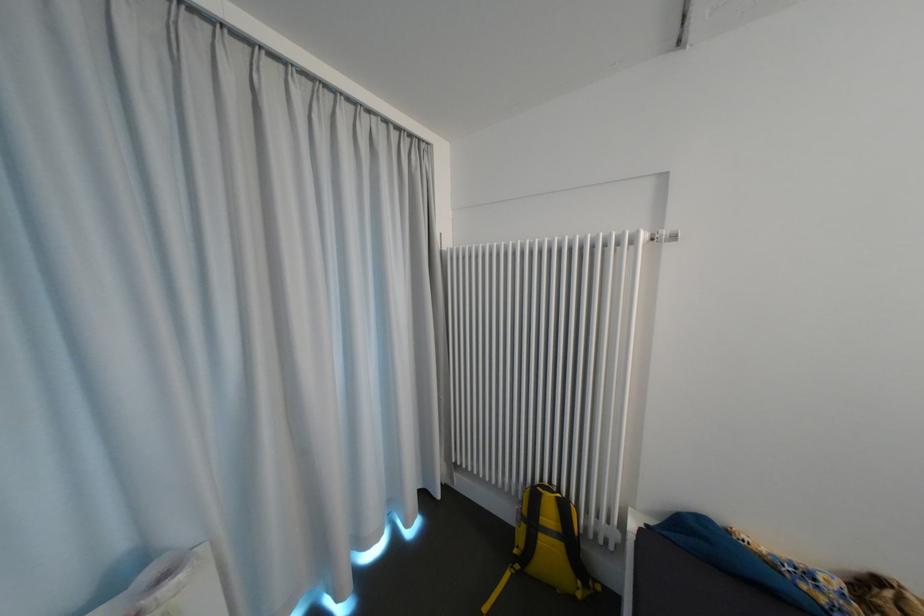
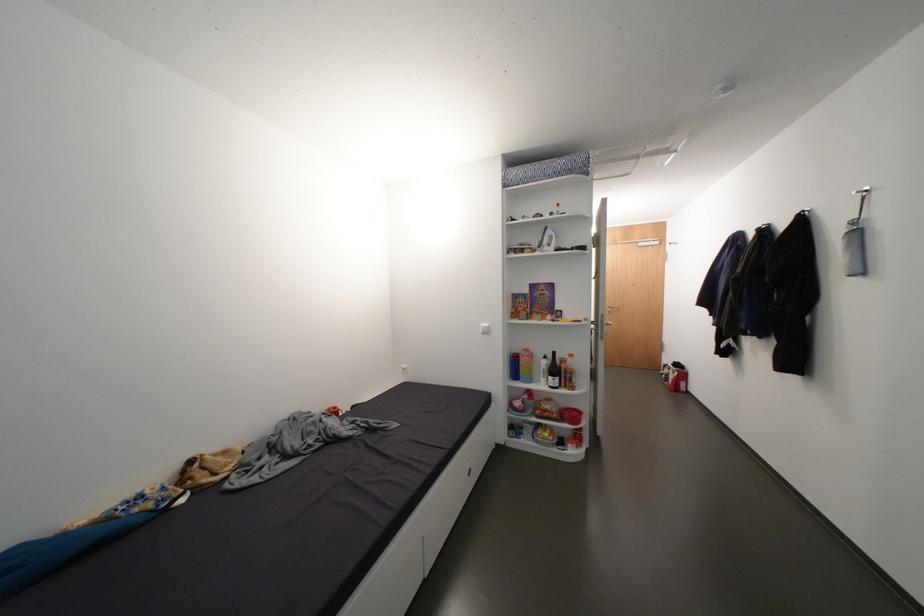
Question: Based on the continuous images, in which direction is the camera rotating? Reply with the corresponding letter.

Choices:
 (A) Left
 (B) Right
 (C) Up
 (D) Down

Answer: (B)